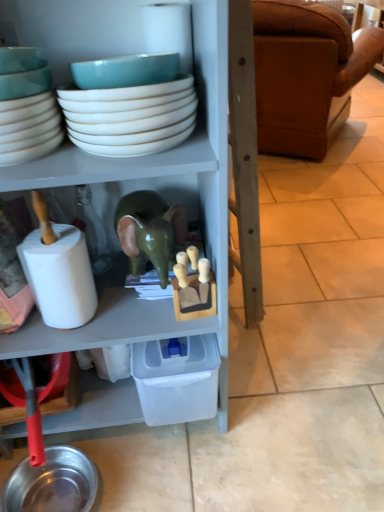
Question: Is green glossy elephant at center facing away from teal ceramic bowl at upper left, marked as the 1th bowl in a left-to-right arrangement?

Choices:
 (A) no
 (B) yes

Answer: (A)

Question: Does green glossy elephant at center appear on the right side of teal ceramic bowl at upper left, marked as the 2th bowl in a right-to-left arrangement?

Choices:
 (A) no
 (B) yes

Answer: (B)

Question: Considering the relative sizes of green glossy elephant at center and teal ceramic bowl at upper left, marked as the 2th bowl in a right-to-left arrangement, in the image provided, is green glossy elephant at center bigger than teal ceramic bowl at upper left, marked as the 2th bowl in a right-to-left arrangement,?

Choices:
 (A) no
 (B) yes

Answer: (B)

Question: Is green glossy elephant at center behind teal ceramic bowl at upper left, marked as the 1th bowl in a left-to-right arrangement?

Choices:
 (A) no
 (B) yes

Answer: (B)

Question: From a real-world perspective, is green glossy elephant at center under teal ceramic bowl at upper left, marked as the 2th bowl in a right-to-left arrangement?

Choices:
 (A) no
 (B) yes

Answer: (B)

Question: From a real-world perspective, is brown leather couch at right positioned above or below teal ceramic bowl at upper left, marked as the 2th bowl in a right-to-left arrangement?

Choices:
 (A) below
 (B) above

Answer: (A)

Question: Which is correct: brown leather couch at right is inside teal ceramic bowl at upper left, marked as the 1th bowl in a left-to-right arrangement, or outside of it?

Choices:
 (A) outside
 (B) inside

Answer: (A)

Question: Would you say brown leather couch at right is to the left or to the right of teal ceramic bowl at upper left, marked as the 1th bowl in a left-to-right arrangement, in the picture?

Choices:
 (A) right
 (B) left

Answer: (A)

Question: Looking at the image, does brown leather couch at right seem bigger or smaller compared to teal ceramic bowl at upper left, marked as the 2th bowl in a right-to-left arrangement?

Choices:
 (A) small
 (B) big

Answer: (B)

Question: In terms of size, does teal ceramic bowl at upper left, marked as the 2th bowl in a right-to-left arrangement, appear bigger or smaller than white glossy bowls at upper center, which is the 2th bowl in left-to-right order?

Choices:
 (A) small
 (B) big

Answer: (A)

Question: Is teal ceramic bowl at upper left, marked as the 2th bowl in a right-to-left arrangement, inside or outside of white glossy bowls at upper center, the 1th bowl when ordered from right to left?

Choices:
 (A) outside
 (B) inside

Answer: (A)

Question: Is teal ceramic bowl at upper left, marked as the 1th bowl in a left-to-right arrangement, taller or shorter than white glossy bowls at upper center, the 1th bowl when ordered from right to left?

Choices:
 (A) tall
 (B) short

Answer: (B)

Question: Based on their positions, is teal ceramic bowl at upper left, marked as the 1th bowl in a left-to-right arrangement, located to the left or right of white glossy bowls at upper center, which is the 2th bowl in left-to-right order?

Choices:
 (A) left
 (B) right

Answer: (A)

Question: From a real-world perspective, relative to teal ceramic bowl at upper left, marked as the 2th bowl in a right-to-left arrangement, is white matte toilet paper at left vertically above or below?

Choices:
 (A) above
 (B) below

Answer: (B)

Question: Visually, is white matte toilet paper at left positioned to the left or to the right of teal ceramic bowl at upper left, marked as the 2th bowl in a right-to-left arrangement?

Choices:
 (A) left
 (B) right

Answer: (B)